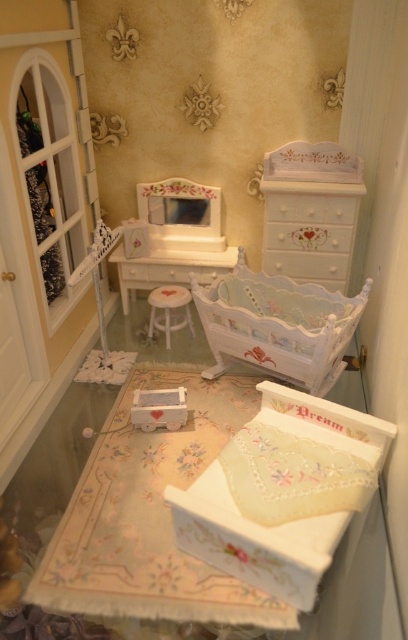
You are a dollhouse designer who wants to place a new decorative item between the white painted wood dresser at upper center and the white fabric stool at center. Based on their positions, which object should the decorative item be placed closer to?

The decorative item should be placed closer to the white fabric stool at center because the white painted wood dresser at upper center is closer to the viewer, meaning the stool is further back. To place the item between them, it should be nearer to the stool to maintain the spatial arrangement.